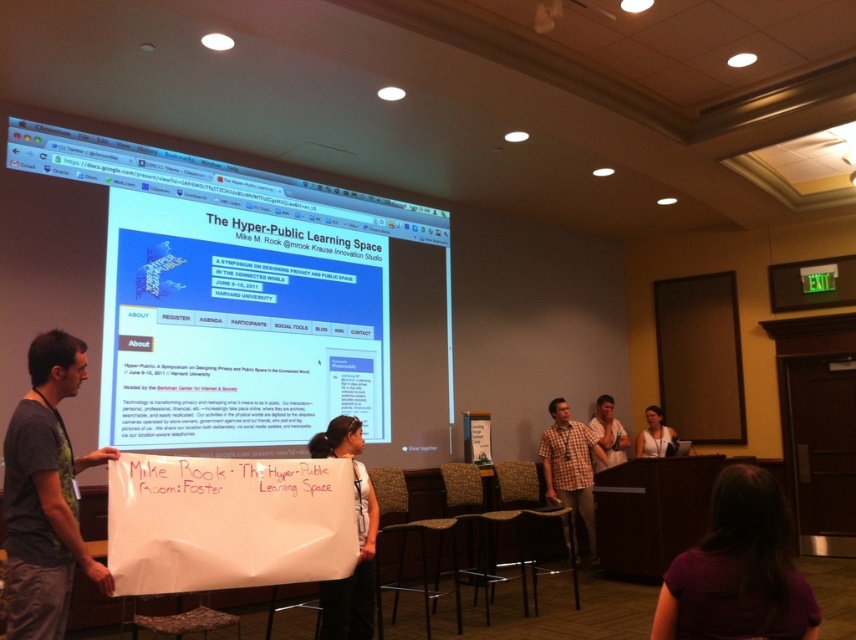
Does gray fabric banner at left have a greater width compared to checkered fabric shirt at center?

No.

Identify the location of gray fabric banner at left. click(x=46, y=493).

From the picture: How distant is white paperboard at center from plaid shirt at center?

4.31 meters

Can you confirm if white paperboard at center is shorter than plaid shirt at center?

In fact, white paperboard at center may be taller than plaid shirt at center.

Is point (331, 596) more distant than point (607, 440)?

No, (331, 596) is closer to viewer.

What are the coordinates of `white paperboard at center` in the screenshot? It's located at click(x=358, y=540).

Does purple fabric shirt at lower center have a lesser width compared to white paperboard at center?

No.

This screenshot has width=856, height=640. What do you see at coordinates (738, 570) in the screenshot?
I see `purple fabric shirt at lower center` at bounding box center [738, 570].

At what (x,y) coordinates should I click in order to perform the action: click on purple fabric shirt at lower center. Please return your answer as a coordinate pair (x, y). Looking at the image, I should click on [738, 570].